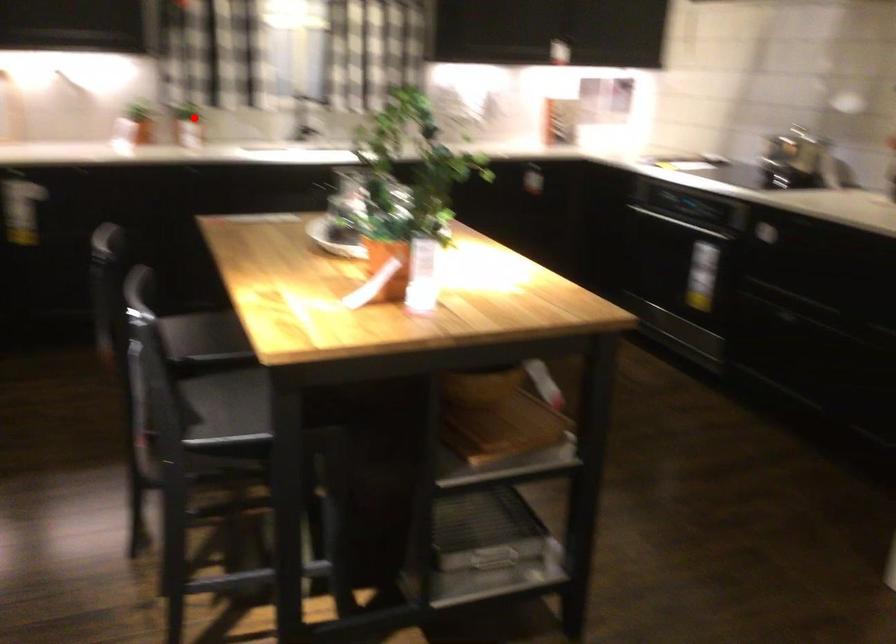
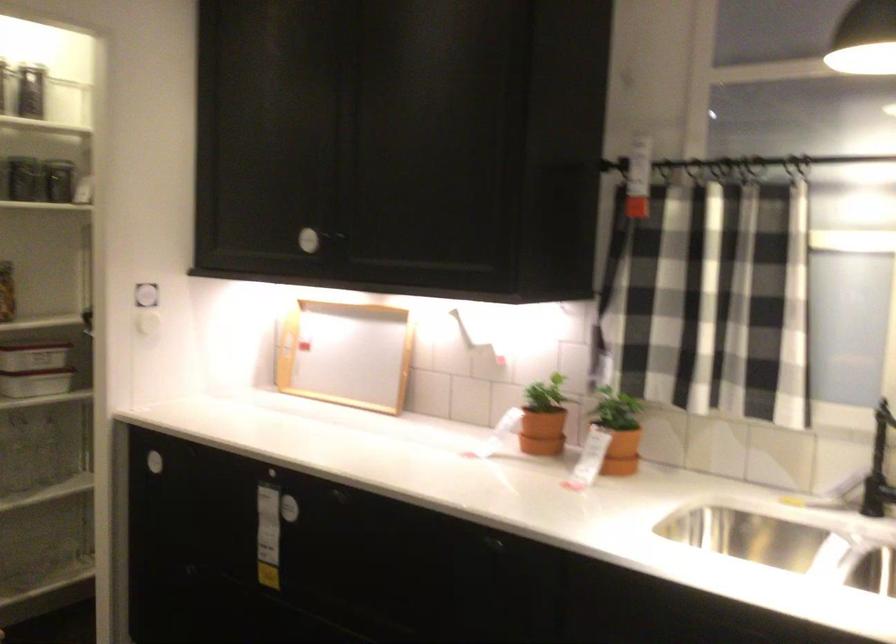
Question: I am providing you with two images of the same scene from different viewpoints. A red point is shown in image1. For the corresponding object point in image2, is it positioned nearer or farther from the camera?

Choices:
 (A) Nearer
 (B) Farther

Answer: (A)